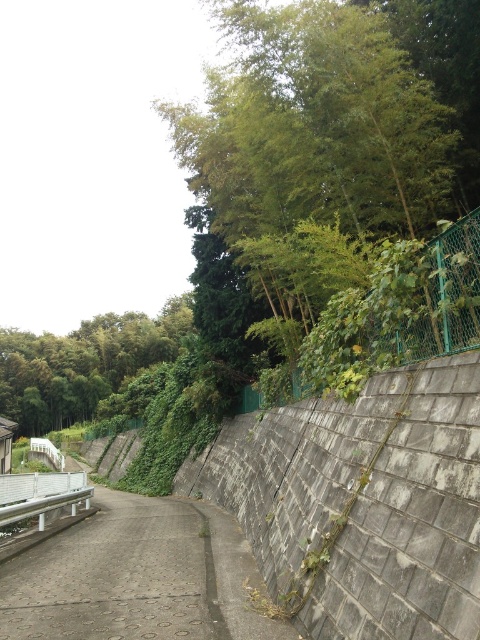
You are standing at the point labeled point (336, 116) in the image. What object is located at that point?

The point (336, 116) indicates green bamboo at upper right.

You are standing on the paved pathway and want to know which plant has a wider spread between the green bamboo at upper right and the green leafy tree at upper left.

The green leafy tree at upper left has a wider spread than the green bamboo at upper right.